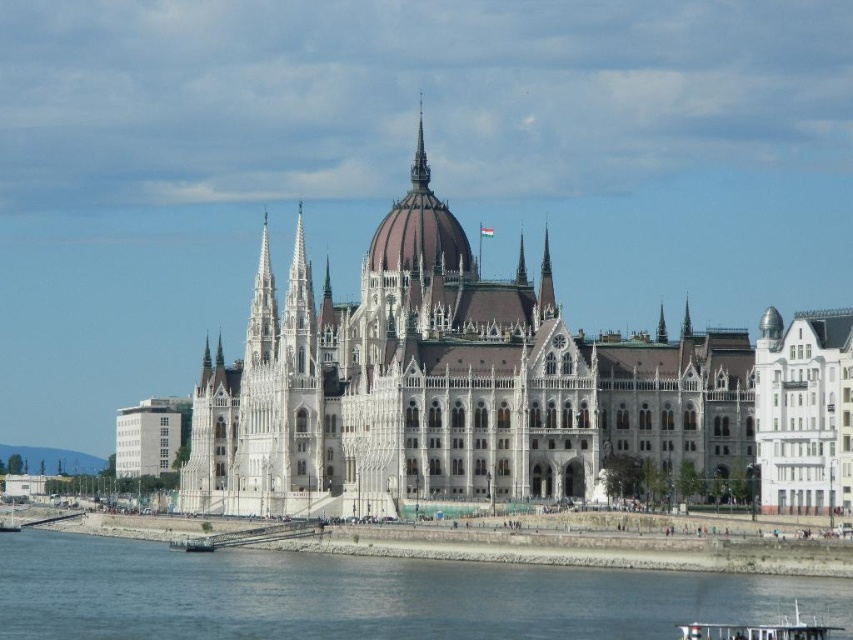
Can you confirm if white stone palace at center is bigger than gray concrete river at lower center?

Indeed, white stone palace at center has a larger size compared to gray concrete river at lower center.

Does white stone palace at center appear under gray concrete river at lower center?

Incorrect, white stone palace at center is not positioned below gray concrete river at lower center.

Who is more forward, (289, 465) or (53, 545)?

Point (289, 465) is in front.

The image size is (853, 640). I want to click on white stone palace at center, so click(448, 387).

Consider the image. Which is more to the right, white stone palace at center or smooth silver spire at upper center?

smooth silver spire at upper center is more to the right.

Is white stone palace at center bigger than smooth silver spire at upper center?

Yes, white stone palace at center is bigger than smooth silver spire at upper center.

Does point (421, 381) come behind point (663, 317)?

No, it is in front of (663, 317).

Find the location of a particular element. This screenshot has width=853, height=640. white stone palace at center is located at coordinates click(x=448, y=387).

Does white stone palace at center have a larger size compared to white wooden boat at lower center?

Yes.

Who is more forward, (291, 401) or (747, 636)?

Positioned in front is point (747, 636).

Which is behind, point (370, 280) or point (682, 630)?

Positioned behind is point (370, 280).

Identify the location of white stone palace at center. Image resolution: width=853 pixels, height=640 pixels. (448, 387).